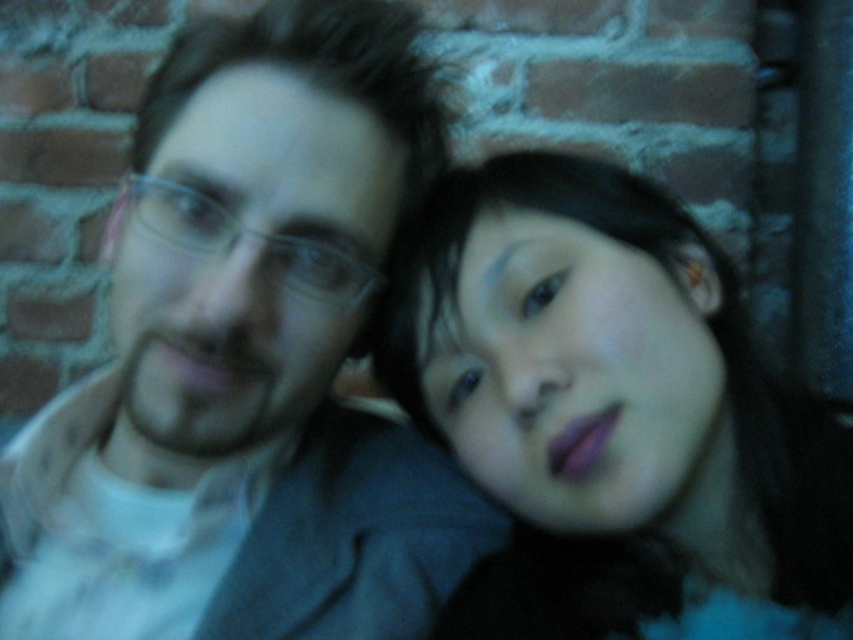
Does matte white shirt at center have a lesser width compared to matte black hair at center?

In fact, matte white shirt at center might be wider than matte black hair at center.

The image size is (853, 640). Identify the location of matte white shirt at center. (247, 362).

Is point (311, 419) behind point (671, 632)?

Yes.

The width and height of the screenshot is (853, 640). I want to click on matte white shirt at center, so click(247, 362).

Which is below, matte black hair at center or clear plastic glasses at center?

matte black hair at center is lower down.

Who is positioned more to the left, matte black hair at center or clear plastic glasses at center?

From the viewer's perspective, clear plastic glasses at center appears more on the left side.

Is point (532, 385) less distant than point (132, 196)?

Yes, point (532, 385) is in front of point (132, 196).

Where is `matte black hair at center`? Image resolution: width=853 pixels, height=640 pixels. matte black hair at center is located at coordinates pos(612,413).

Who is taller, matte white shirt at center or clear plastic glasses at center?

Standing taller between the two is matte white shirt at center.

Locate an element on the screen. This screenshot has width=853, height=640. matte white shirt at center is located at coordinates (247, 362).

Is point (323, 349) behind point (167, 228)?

Yes, it is.

Identify the location of matte white shirt at center. The height and width of the screenshot is (640, 853). 247,362.